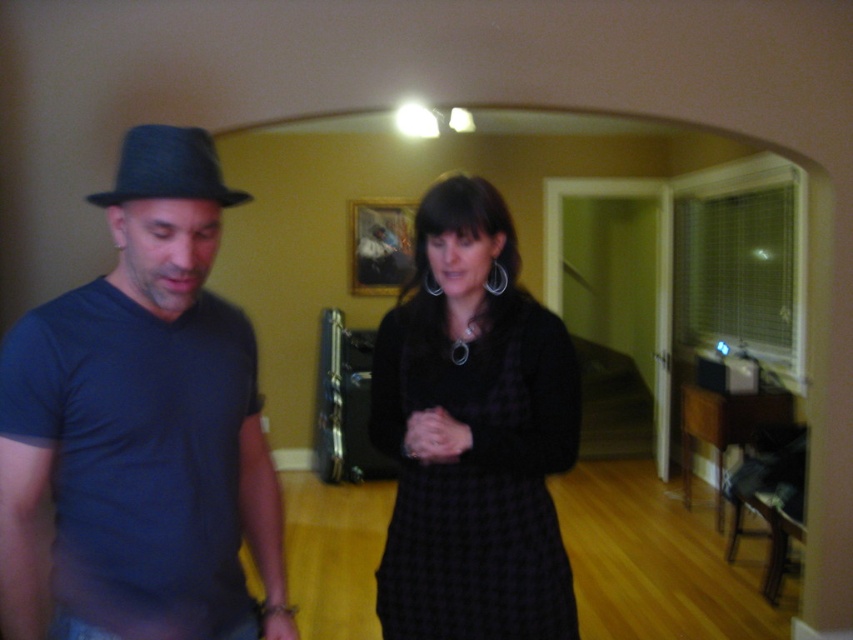
Question: Among these points, which one is nearest to the camera?

Choices:
 (A) (187, 192)
 (B) (572, 353)
 (C) (166, 547)

Answer: (A)

Question: Observing the image, what is the correct spatial positioning of dark blue t-shirt at left in reference to black felt fedora at left?

Choices:
 (A) left
 (B) right

Answer: (A)

Question: Does dark blue t-shirt at left have a greater width compared to black felt fedora at left?

Choices:
 (A) no
 (B) yes

Answer: (B)

Question: Which object is closer to the camera taking this photo?

Choices:
 (A) dark blue t-shirt at left
 (B) black textured dress at center
 (C) black felt fedora at left

Answer: (A)

Question: Which point appears closest to the camera in this image?

Choices:
 (A) (550, 420)
 (B) (16, 410)

Answer: (B)

Question: In this image, where is dark blue t-shirt at left located relative to black textured dress at center?

Choices:
 (A) right
 (B) left

Answer: (B)